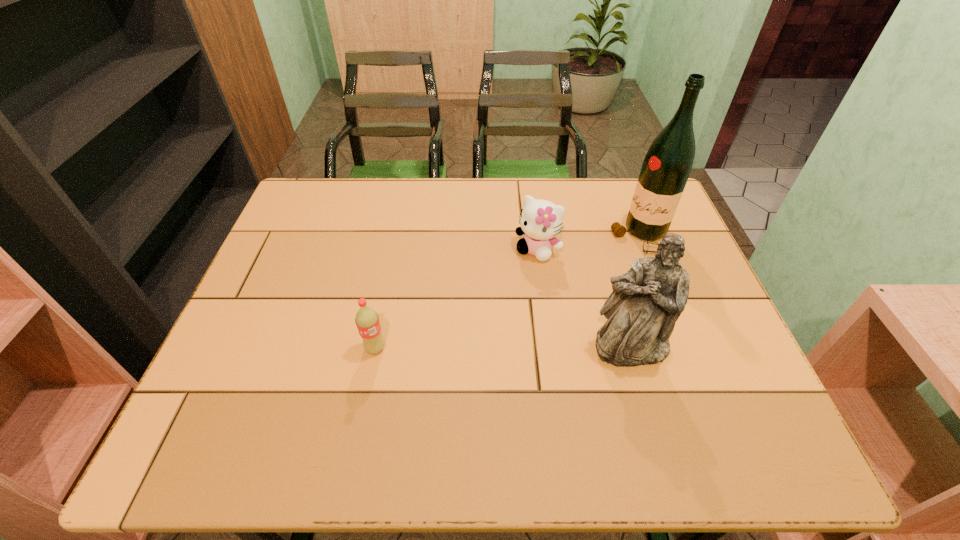
Locate an element on the screen. This screenshot has height=540, width=960. vacant space located 0.200m on the surface of the wine bottle is located at coordinates [x=584, y=291].

The height and width of the screenshot is (540, 960). I want to click on free region located on the surface of the wine bottle, so click(x=562, y=310).

Where is `object situated at the far edge`? object situated at the far edge is located at coordinates (667, 165).

This screenshot has width=960, height=540. What are the coordinates of `figurine situated at the right edge` in the screenshot? It's located at (647, 300).

Locate an element on the screen. The height and width of the screenshot is (540, 960). wine bottle that is at the right edge is located at coordinates (667, 165).

Find the location of a particular element. The height and width of the screenshot is (540, 960). object that is at the far right corner is located at coordinates (667, 165).

The width and height of the screenshot is (960, 540). Find the location of `free space at the far edge`. free space at the far edge is located at coordinates (350, 215).

Locate an element on the screen. free space at the near edge is located at coordinates (305, 406).

Where is `blank area at the left edge`? Image resolution: width=960 pixels, height=540 pixels. blank area at the left edge is located at coordinates (273, 322).

This screenshot has height=540, width=960. Identify the location of free space at the far left corner of the desktop. (343, 214).